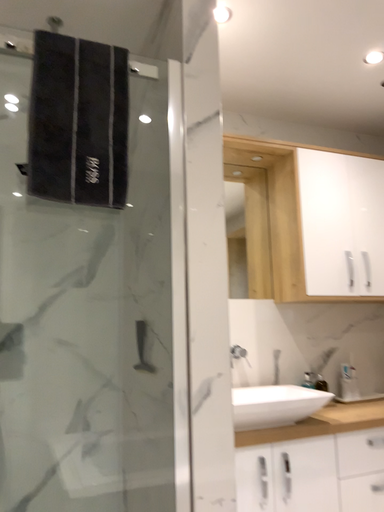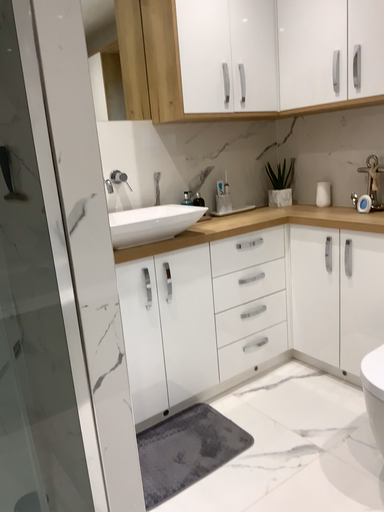
Question: Which way did the camera rotate in the video?

Choices:
 (A) rotated downward
 (B) rotated upward

Answer: (A)